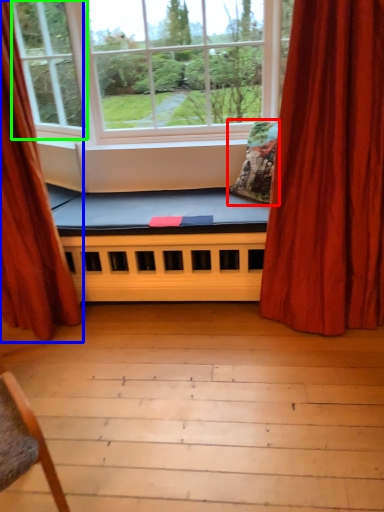
Question: Based on their relative distances, which object is nearer to pillow (highlighted by a red box)? Choose from curtain (highlighted by a blue box) and window (highlighted by a green box).

Choices:
 (A) curtain
 (B) window

Answer: (A)